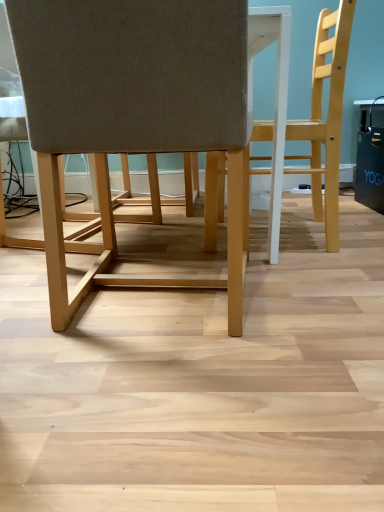
Question: Considering the positions of light wood chair at right, which is the second chair from left to right, and light brown fabric chair at center, which is the 1th chair in left-to-right order, in the image, is light wood chair at right, which is the second chair from left to right, bigger or smaller than light brown fabric chair at center, which is the 1th chair in left-to-right order,?

Choices:
 (A) small
 (B) big

Answer: (A)

Question: From the image's perspective, relative to light brown fabric chair at center, placed as the 2th chair when sorted from right to left, is light wood chair at right, the 1th chair positioned from the right, above or below?

Choices:
 (A) above
 (B) below

Answer: (A)

Question: Considering the positions of light wood chair at right, which is the second chair from left to right, and light brown fabric chair at center, placed as the 2th chair when sorted from right to left, in the image, is light wood chair at right, which is the second chair from left to right, taller or shorter than light brown fabric chair at center, placed as the 2th chair when sorted from right to left,?

Choices:
 (A) short
 (B) tall

Answer: (B)

Question: Relative to light wood chair at right, which is the second chair from left to right, is light brown fabric chair at center, which is the 1th chair in left-to-right order, in front or behind?

Choices:
 (A) front
 (B) behind

Answer: (A)

Question: Is light brown fabric chair at center, placed as the 2th chair when sorted from right to left, wider or thinner than light wood chair at right, the 1th chair positioned from the right?

Choices:
 (A) wide
 (B) thin

Answer: (A)

Question: From a real-world perspective, is light brown fabric chair at center, which is the 1th chair in left-to-right order, above or below light wood chair at right, which is the second chair from left to right?

Choices:
 (A) below
 (B) above

Answer: (A)

Question: Is point (150, 60) positioned closer to the camera than point (342, 6)?

Choices:
 (A) farther
 (B) closer

Answer: (B)